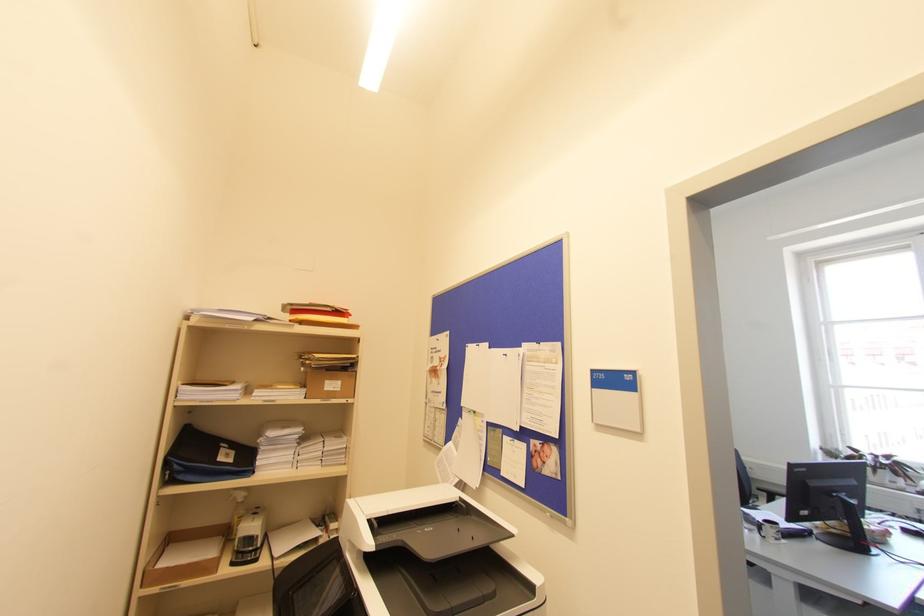
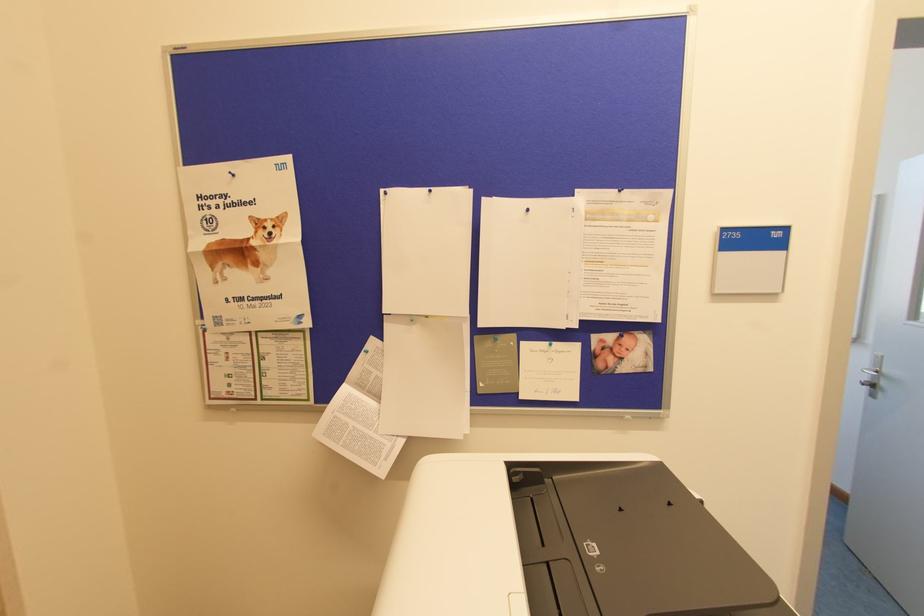
The point at (505, 354) is marked in the first image. Where is the corresponding point in the second image?

(527, 209)